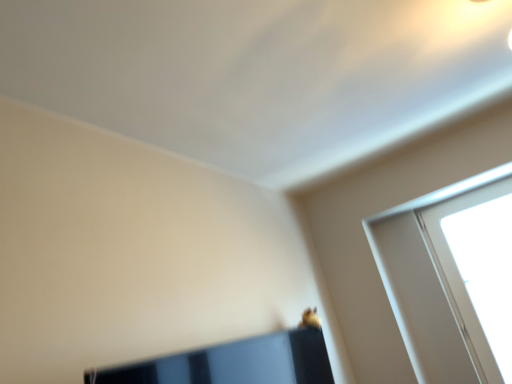
What do you see at coordinates (234, 363) in the screenshot?
I see `glossy black tv at upper right` at bounding box center [234, 363].

Locate an element on the screen. Image resolution: width=512 pixels, height=384 pixels. glossy black tv at upper right is located at coordinates (234, 363).

Locate an element on the screen. The height and width of the screenshot is (384, 512). glossy black tv at upper right is located at coordinates (234, 363).